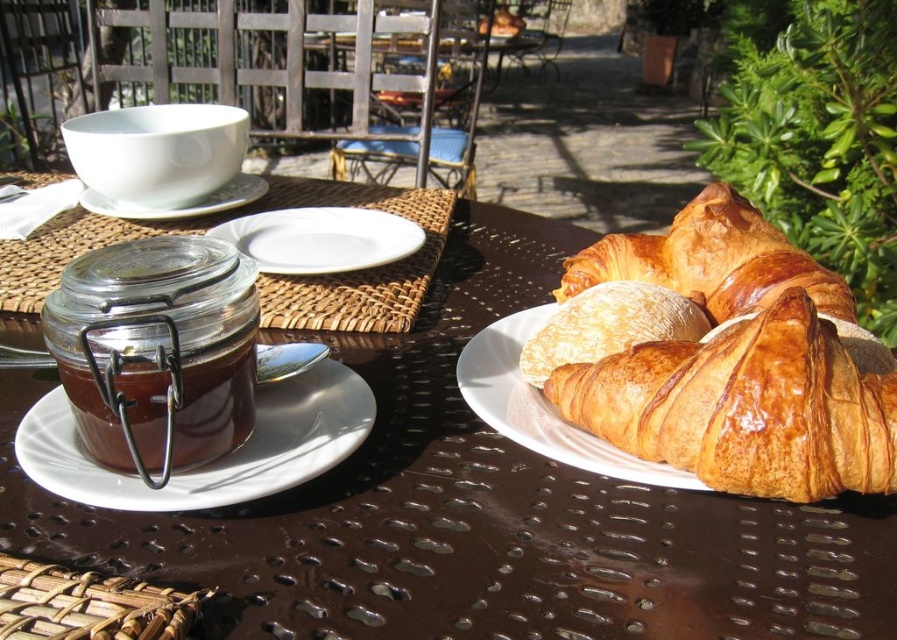
Is golden brown flaky croissant at right shorter than white ceramic saucer at upper left?

In fact, golden brown flaky croissant at right may be taller than white ceramic saucer at upper left.

Does point (695, 380) come farther from viewer compared to point (192, 205)?

No, (695, 380) is closer to viewer.

Locate an element on the screen. This screenshot has width=897, height=640. golden brown flaky croissant at right is located at coordinates (745, 406).

Is point (320, 637) closer to camera compared to point (771, 310)?

That is True.

Between point (414, 531) and point (652, 342), which one is positioned in front?

Positioned in front is point (414, 531).

At what (x,y) coordinates should I click in order to perform the action: click on brown textured table at center. Please return your answer as a coordinate pair (x, y). Looking at the image, I should click on (475, 509).

In the scene shown: Does brown textured table at center have a lesser height compared to translucent glass jar at left?

No, brown textured table at center is not shorter than translucent glass jar at left.

What do you see at coordinates (475, 509) in the screenshot? This screenshot has height=640, width=897. I see `brown textured table at center` at bounding box center [475, 509].

Locate an element on the screen. Image resolution: width=897 pixels, height=640 pixels. brown textured table at center is located at coordinates (475, 509).